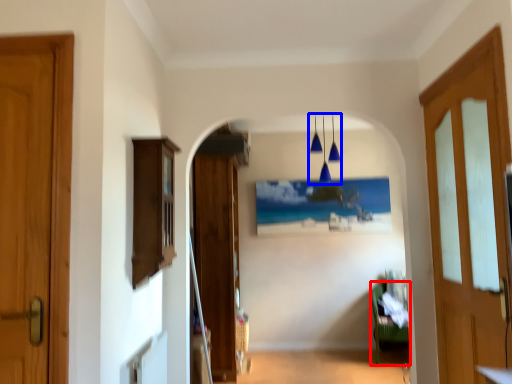
Question: Which object is closer to the camera taking this photo, furniture (highlighted by a red box) or light fixture (highlighted by a blue box)?

Choices:
 (A) furniture
 (B) light fixture

Answer: (B)